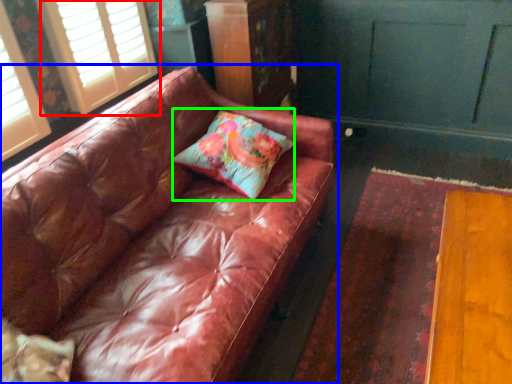
Question: Considering the real-world distances, which object is closest to window (highlighted by a red box)? studio couch (highlighted by a blue box) or pillow (highlighted by a green box).

Choices:
 (A) studio couch
 (B) pillow

Answer: (A)